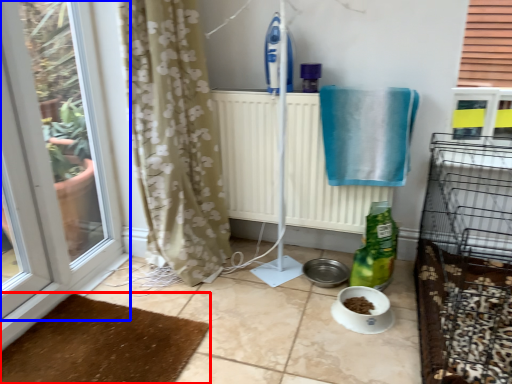
Question: Among these objects, which one is farthest to the camera, doormat (highlighted by a red box) or window (highlighted by a blue box)?

Choices:
 (A) doormat
 (B) window

Answer: (A)